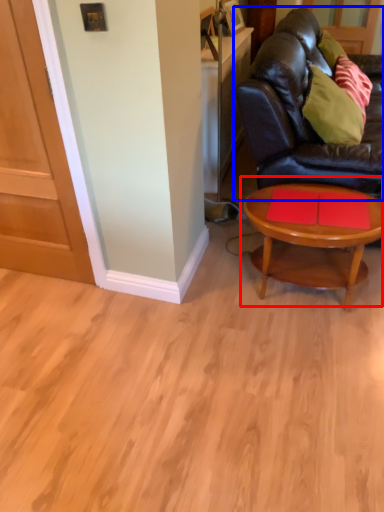
Question: Which of the following is the closest to the observer, coffee table (highlighted by a red box) or studio couch (highlighted by a blue box)?

Choices:
 (A) coffee table
 (B) studio couch

Answer: (B)